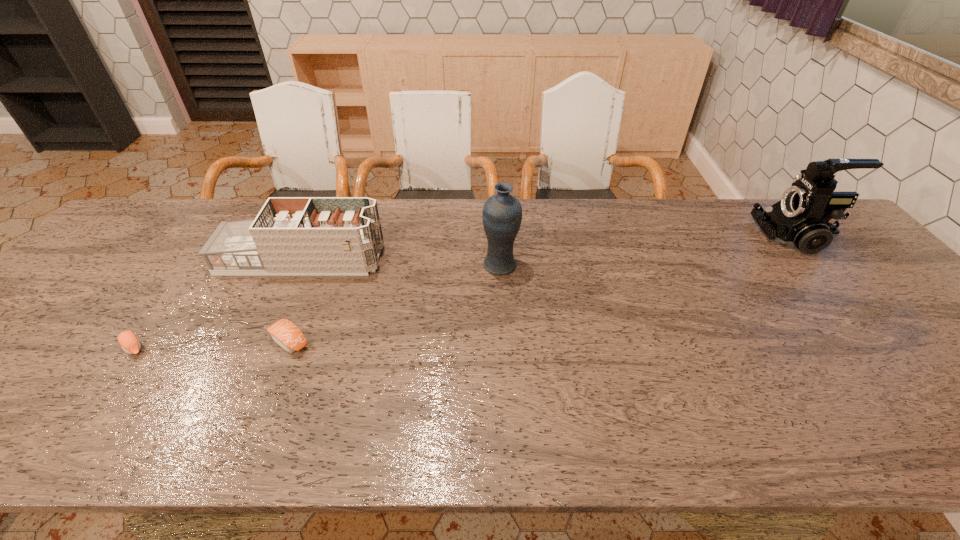
Locate an element on the screen. free spot between the third tallest object and the taller sushi is located at coordinates (296, 300).

Where is `object that ranks as the closest to the third tallest object`? The image size is (960, 540). object that ranks as the closest to the third tallest object is located at coordinates (287, 335).

Identify which object is the fourth closest to the shortest object. Please provide its 2D coordinates. Your answer should be formatted as a tuple, i.e. [(x, y)], where the tuple contains the x and y coordinates of a point satisfying the conditions above.

[(803, 219)]

At what (x,y) coordinates should I click in order to perform the action: click on vacant region that satisfies the following two spatial constraints: 1. at the entrance of the fourth object from left to right; 2. on the right side of the dollhouse. Please return your answer as a coordinate pair (x, y). Looking at the image, I should click on (299, 266).

This screenshot has height=540, width=960. What are the coordinates of `vacant position in the image that satisfies the following two spatial constraints: 1. on the back side of the taller sushi; 2. at the entrance of the dollhouse` in the screenshot? It's located at (323, 259).

I want to click on free space that satisfies the following two spatial constraints: 1. at the entrance of the fourth object from left to right; 2. on the right side of the dollhouse, so click(x=299, y=266).